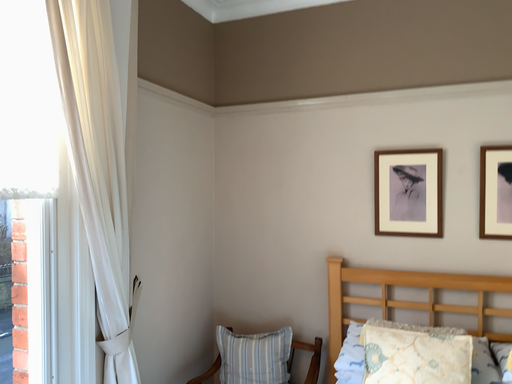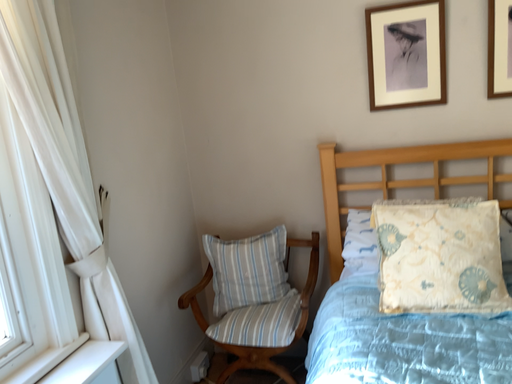
Question: Which way did the camera rotate in the video?

Choices:
 (A) rotated downward
 (B) rotated upward

Answer: (A)